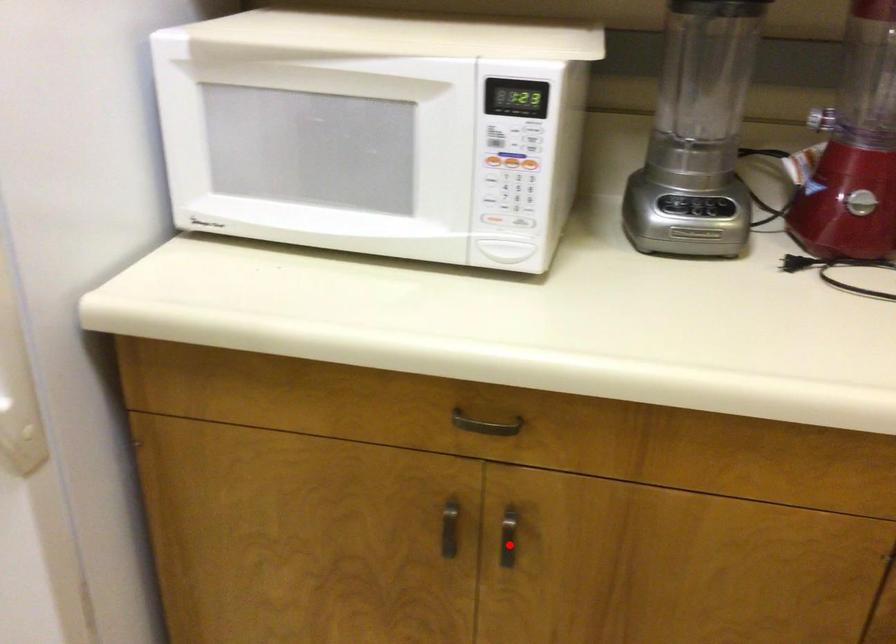
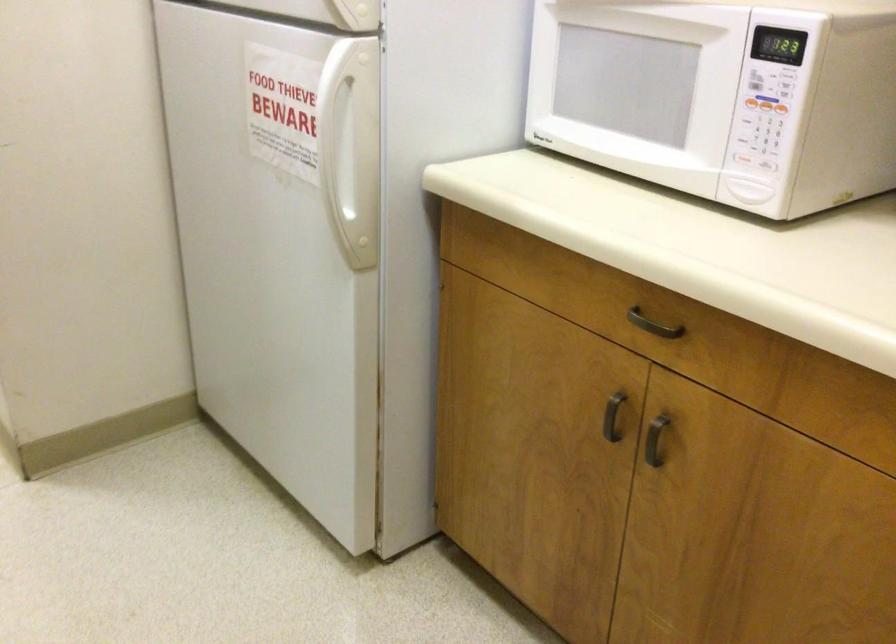
Question: A red point is marked in image1. In image2, is the corresponding 3D point closer to the camera or farther? Reply with the corresponding letter.

Choices:
 (A) The corresponding 3D point is closer.
 (B) The corresponding 3D point is farther.

Answer: (B)